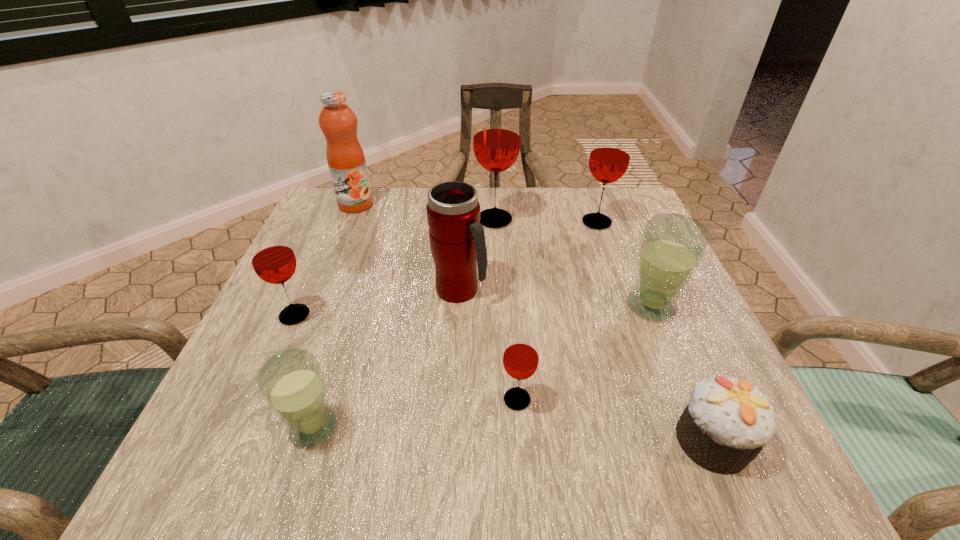
I want to click on vacant point located between the orange fruit juice and the biggest red glass, so pos(425,212).

Locate an element on the screen. unoccupied position between the tallest glass and the smallest red glass is located at coordinates (506, 309).

Find the location of a particular element. The width and height of the screenshot is (960, 540). unoccupied position between the biggest red glass and the shortest object is located at coordinates (604, 329).

The width and height of the screenshot is (960, 540). Identify the location of vacant area that lies between the red thermos bottle and the nearest red glass. (489, 345).

The height and width of the screenshot is (540, 960). I want to click on empty location between the second nearest red glass and the fruit juice, so click(325, 260).

You are a GUI agent. You are given a task and a screenshot of the screen. Output one action in this format:
    pyautogui.click(x=<x>, y=<y>)
    Task: Click on the object that is the seventh closest to the fifth shortest glass
    The height and width of the screenshot is (540, 960).
    Given the screenshot: What is the action you would take?
    pyautogui.click(x=272, y=257)

This screenshot has width=960, height=540. I want to click on object that can be found as the second closest to the third smallest red glass, so click(672, 245).

Identify which glass is located as the fourth nearest to the fruit juice. Please provide its 2D coordinates. Your answer should be formatted as a tuple, i.e. [(x, y)], where the tuple contains the x and y coordinates of a point satisfying the conditions above.

[(291, 382)]

Identify which glass is located as the second nearest to the smallest red glass. Please provide its 2D coordinates. Your answer should be formatted as a tuple, i.e. [(x, y)], where the tuple contains the x and y coordinates of a point satisfying the conditions above.

[(291, 382)]

Choose which red glass is the second nearest neighbor to the third farthest red glass. Please provide its 2D coordinates. Your answer should be formatted as a tuple, i.e. [(x, y)], where the tuple contains the x and y coordinates of a point satisfying the conditions above.

[(496, 142)]